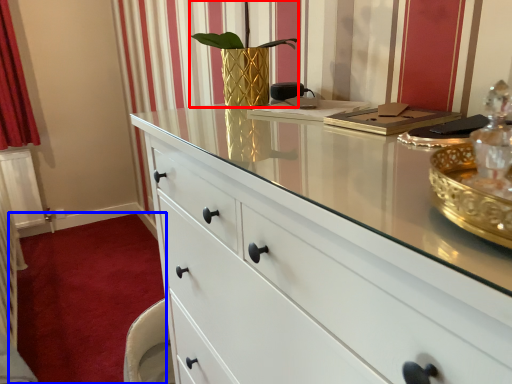
Question: Which object is closer to the camera taking this photo, plant (highlighted by a red box) or plain (highlighted by a blue box)?

Choices:
 (A) plant
 (B) plain

Answer: (A)